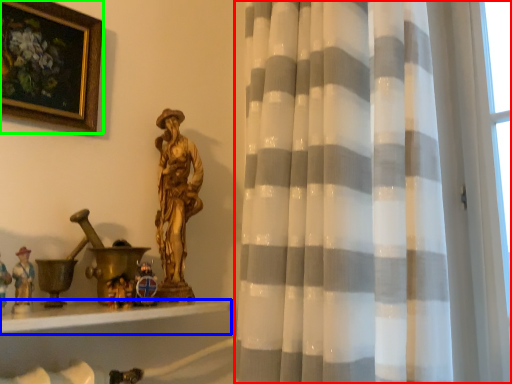
Question: Considering the real-world distances, which object is farthest from curtain (highlighted by a red box)? window sill (highlighted by a blue box) or picture frame (highlighted by a green box)?

Choices:
 (A) window sill
 (B) picture frame

Answer: (B)